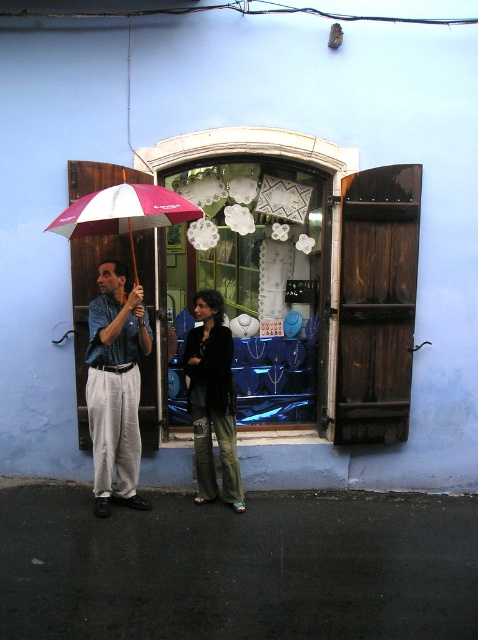
Can you confirm if matte glass jewelry at center is thinner than dark brown wooden shutter at right?

In fact, matte glass jewelry at center might be wider than dark brown wooden shutter at right.

Between point (275, 346) and point (377, 419), which one is positioned behind?

Point (275, 346)

Does point (295, 288) come in front of point (358, 353)?

No, it is behind (358, 353).

Identify the location of matte glass jewelry at center. (256, 284).

Between matte blue pants at left and dark green textured pants at center, which one is positioned higher?

matte blue pants at left

Who is shorter, matte blue pants at left or dark green textured pants at center?

With less height is dark green textured pants at center.

Is point (134, 476) closer to viewer compared to point (221, 426)?

No, (134, 476) is further to viewer.

Image resolution: width=478 pixels, height=640 pixels. In order to click on matte blue pants at left in this screenshot , I will do `click(116, 387)`.

Based on the photo, who is taller, dark brown wooden shutter at right or matte blue pants at left?

With more height is dark brown wooden shutter at right.

Which is above, dark brown wooden shutter at right or matte blue pants at left?

dark brown wooden shutter at right is above.

Is point (352, 259) in front of point (106, 472)?

No, it is behind (106, 472).

Identify the location of dark brown wooden shutter at right. The width and height of the screenshot is (478, 640). click(377, 304).